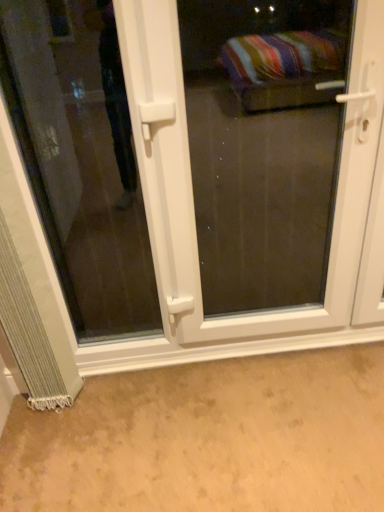
Question: Is silvery textured curtain at lower left facing towards transparent glass door at lower left?

Choices:
 (A) yes
 (B) no

Answer: (B)

Question: From the image's perspective, is silvery textured curtain at lower left beneath transparent glass door at lower left?

Choices:
 (A) yes
 (B) no

Answer: (A)

Question: Considering the relative sizes of silvery textured curtain at lower left and transparent glass door at lower left in the image provided, is silvery textured curtain at lower left bigger than transparent glass door at lower left?

Choices:
 (A) yes
 (B) no

Answer: (B)

Question: Is transparent glass door at lower left at the back of silvery textured curtain at lower left?

Choices:
 (A) yes
 (B) no

Answer: (B)

Question: Could transparent glass door at lower left be considered to be inside silvery textured curtain at lower left?

Choices:
 (A) no
 (B) yes

Answer: (A)

Question: Relative to transparent glass door at lower left, is white plastic door at center in front or behind?

Choices:
 (A) behind
 (B) front

Answer: (B)

Question: From the image's perspective, is white plastic door at center positioned above or below transparent glass door at lower left?

Choices:
 (A) above
 (B) below

Answer: (B)

Question: Looking at their shapes, would you say white plastic door at center is wider or thinner than transparent glass door at lower left?

Choices:
 (A) wide
 (B) thin

Answer: (A)

Question: In terms of height, does white plastic door at center look taller or shorter compared to transparent glass door at lower left?

Choices:
 (A) tall
 (B) short

Answer: (A)

Question: Considering the positions of white plastic door at center and silvery textured curtain at lower left in the image, is white plastic door at center wider or thinner than silvery textured curtain at lower left?

Choices:
 (A) thin
 (B) wide

Answer: (A)

Question: From the image's perspective, is white plastic door at center above or below silvery textured curtain at lower left?

Choices:
 (A) below
 (B) above

Answer: (B)

Question: Considering the relative positions of white plastic door at center and silvery textured curtain at lower left in the image provided, is white plastic door at center to the left or to the right of silvery textured curtain at lower left?

Choices:
 (A) right
 (B) left

Answer: (A)

Question: Relative to silvery textured curtain at lower left, is white plastic door at center in front or behind?

Choices:
 (A) front
 (B) behind

Answer: (A)

Question: From a real-world perspective, is transparent glass door at lower left above or below white plastic door at center?

Choices:
 (A) above
 (B) below

Answer: (A)

Question: Relative to white plastic door at center, is transparent glass door at lower left in front or behind?

Choices:
 (A) behind
 (B) front

Answer: (A)